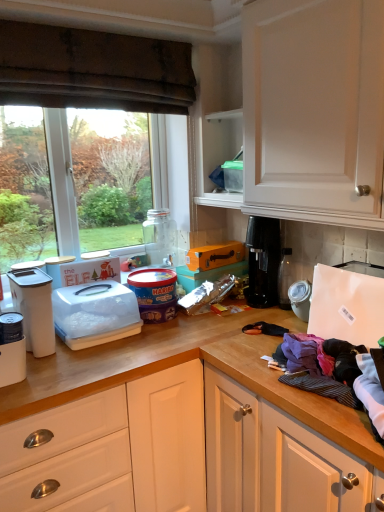
Describe the element at coordinates (95, 314) in the screenshot. The height and width of the screenshot is (512, 384). I see `white plastic container at center-left, which is the third appliance in right-to-left order` at that location.

What do you see at coordinates (215, 255) in the screenshot?
I see `orange cardboard box at center` at bounding box center [215, 255].

What do you see at coordinates (344, 359) in the screenshot?
I see `purple cotton clothes at right, the 2th clothing when ordered from back to front` at bounding box center [344, 359].

You are a GUI agent. You are given a task and a screenshot of the screen. Output one action in this format:
    pyautogui.click(x=<x>, y=<y>)
    Task: Click on the purple cotton clothes at lower right, the 3th clothing from the front
    The height and width of the screenshot is (512, 384).
    Given the screenshot: What is the action you would take?
    pyautogui.click(x=300, y=354)

Describe the element at coordinates (300, 354) in the screenshot. This screenshot has height=512, width=384. I see `purple cotton clothes at lower right, the 3th clothing from the front` at that location.

Where is `transparent glass window at upper left`? The image size is (384, 512). transparent glass window at upper left is located at coordinates (93, 69).

The height and width of the screenshot is (512, 384). Describe the element at coordinates (346, 306) in the screenshot. I see `white matte refrigerator at right, the fifth appliance viewed from the left` at that location.

Find the location of a particular element. The image size is (384, 512). brown fabric curtain at upper left is located at coordinates (93, 70).

Are orange cardboard box at center and white plastic container at center-left, which is counted as the 3th appliance, starting from the left, located far from each other?

No, orange cardboard box at center is not far away from white plastic container at center-left, which is counted as the 3th appliance, starting from the left.

From a real-world perspective, between orange cardboard box at center and white plastic container at center-left, which is counted as the 3th appliance, starting from the left, who is vertically lower?

white plastic container at center-left, which is counted as the 3th appliance, starting from the left.

Which object is further away from the camera, orange cardboard box at center or white plastic container at center-left, which is counted as the 3th appliance, starting from the left?

orange cardboard box at center is further from the camera.

Consider the image. What's the angular difference between orange cardboard box at center and white plastic container at center-left, which is the third appliance in right-to-left order,'s facing directions?

0.00163 degrees separate the facing orientations of orange cardboard box at center and white plastic container at center-left, which is the third appliance in right-to-left order.

Is white plastic container at center-left, which is counted as the 3th appliance, starting from the left, facing towards white matte refrigerator at right, the fifth appliance viewed from the left?

No, white plastic container at center-left, which is counted as the 3th appliance, starting from the left, is not facing towards white matte refrigerator at right, the fifth appliance viewed from the left.

Considering their positions, is white plastic container at center-left, which is the third appliance in right-to-left order, located in front of or behind white matte refrigerator at right, which is the 1th appliance in right-to-left order?

Visually, white plastic container at center-left, which is the third appliance in right-to-left order, is located behind white matte refrigerator at right, which is the 1th appliance in right-to-left order.

From a real-world perspective, is white plastic container at center-left, which is the third appliance in right-to-left order, physically above white matte refrigerator at right, the fifth appliance viewed from the left?

No, from a real-world perspective, white plastic container at center-left, which is the third appliance in right-to-left order, is not above white matte refrigerator at right, the fifth appliance viewed from the left.

This screenshot has height=512, width=384. There is a white matte refrigerator at right, the fifth appliance viewed from the left. Identify the location of the 1st appliance below it (from the image's perspective). (95, 314).

From the image's perspective, is white plastic container at left, the second appliance from the left, positioned above or below purple cotton clothes at lower right, the first clothing in the back-to-front sequence?

From the image's perspective, white plastic container at left, the second appliance from the left, appears above purple cotton clothes at lower right, the first clothing in the back-to-front sequence.

Is white plastic container at left, the second appliance from the left, positioned beyond the bounds of purple cotton clothes at lower right, the 3th clothing from the front?

white plastic container at left, the second appliance from the left, lies outside purple cotton clothes at lower right, the 3th clothing from the front,'s area.

Considering the sizes of white plastic container at left, the second appliance from the left, and purple cotton clothes at lower right, the first clothing in the back-to-front sequence, in the image, is white plastic container at left, the second appliance from the left, bigger or smaller than purple cotton clothes at lower right, the first clothing in the back-to-front sequence,?

Considering their sizes, white plastic container at left, the second appliance from the left, takes up more space than purple cotton clothes at lower right, the first clothing in the back-to-front sequence.

Are transparent glass jar at center and white plastic container at center-left, which is the third appliance in right-to-left order, far apart?

transparent glass jar at center is near white plastic container at center-left, which is the third appliance in right-to-left order, not far away.

From the image's perspective, between transparent glass jar at center and white plastic container at center-left, which is counted as the 3th appliance, starting from the left, which one is located above?

transparent glass jar at center, from the image's perspective.

Can you confirm if transparent glass jar at center is positioned to the left of white plastic container at center-left, which is counted as the 3th appliance, starting from the left?

Incorrect, transparent glass jar at center is not on the left side of white plastic container at center-left, which is counted as the 3th appliance, starting from the left.

Does transparent glass jar at center have a lesser width compared to white plastic container at center-left, which is the third appliance in right-to-left order?

Yes.

Is brown fabric curtain at upper left positioned in front of purple cotton clothes at right, the 2th clothing when ordered from back to front?

No, the depth of brown fabric curtain at upper left is greater than that of purple cotton clothes at right, the 2th clothing when ordered from back to front.

Which of these two, brown fabric curtain at upper left or purple cotton clothes at right, the 2th clothing when ordered from back to front, is bigger?

With larger size is brown fabric curtain at upper left.

From a real-world perspective, who is located higher, brown fabric curtain at upper left or purple cotton clothes at right, which appears as the second clothing when viewed from the front?

brown fabric curtain at upper left is physically above.

From the image's perspective, is brown fabric curtain at upper left on top of purple cotton clothes at right, which appears as the second clothing when viewed from the front?

Yes, from the image's perspective, brown fabric curtain at upper left is on top of purple cotton clothes at right, which appears as the second clothing when viewed from the front.

Based on the photo, considering the relative positions of white plastic container at left, the second appliance from the left, and purple cotton clothes at right, the 2th clothing when ordered from back to front, in the image provided, is white plastic container at left, the second appliance from the left, to the left or to the right of purple cotton clothes at right, the 2th clothing when ordered from back to front,?

Clearly, white plastic container at left, the second appliance from the left, is on the left of purple cotton clothes at right, the 2th clothing when ordered from back to front, in the image.

Could you tell me if white plastic container at left, the second appliance from the left, is turned towards purple cotton clothes at right, the 2th clothing when ordered from back to front?

No, white plastic container at left, the second appliance from the left, is not facing towards purple cotton clothes at right, the 2th clothing when ordered from back to front.

Image resolution: width=384 pixels, height=512 pixels. There is a purple cotton clothes at right, the 2th clothing when ordered from back to front. What are the coordinates of `the 4th appliance above it (from the image's perspective)` in the screenshot? It's located at click(56, 268).

Which of these two, white plastic container at left, acting as the fourth appliance starting from the right, or purple cotton clothes at right, which appears as the second clothing when viewed from the front, is thinner?

With smaller width is white plastic container at left, acting as the fourth appliance starting from the right.

Considering the relative sizes of white plastic container at left and orange cardboard box at center in the image provided, is white plastic container at left smaller than orange cardboard box at center?

Incorrect, white plastic container at left is not smaller in size than orange cardboard box at center.

Between white plastic container at left and orange cardboard box at center, which one is positioned behind?

orange cardboard box at center is further from the camera.

Is white plastic container at left aimed at orange cardboard box at center?

No, white plastic container at left is not oriented towards orange cardboard box at center.

From a real-world perspective, does white plastic container at left sit lower than orange cardboard box at center?

Yes, from a real-world perspective, white plastic container at left is beneath orange cardboard box at center.

Find the location of a particular element. This screenshot has width=384, height=512. cardboard box above the white plastic container at center-left, which is counted as the 3th appliance, starting from the left (from a real-world perspective) is located at coordinates (215, 255).

Which appliance is the 2nd one when counting from the back of the white matte refrigerator at right, which is the 1th appliance in right-to-left order? Please provide its 2D coordinates.

[(95, 314)]

Considering their positions, is white plastic container at center-left, which is the third appliance in right-to-left order, positioned further to white plastic container at left than black plastic coffee machine at right?

black plastic coffee machine at right.

Looking at the image, which one is located further to black plastic coffee machine at right, orange cardboard box at center or transparent glass window at upper left?

Among the two, transparent glass window at upper left is located further to black plastic coffee machine at right.

When comparing their distances from brown fabric curtain at upper left, does black plastic coffee machine at right or transparent glass jar at center seem closer?

transparent glass jar at center.

Estimate the real-world distances between objects in this image. Which object is closer to orange cardboard box at center, black plastic coffee machine at right or white plastic container at center-left, which is the third appliance in right-to-left order?

black plastic coffee machine at right.

From the image, which object appears to be nearer to purple cotton clothes at right, the 2th clothing when ordered from back to front, white plastic container at left or orange cardboard box at center?

orange cardboard box at center is positioned closer to the anchor purple cotton clothes at right, the 2th clothing when ordered from back to front.

Considering their positions, is white cotton shirt at lower right, which is the third clothing from back to front, positioned closer to purple cotton clothes at lower right, the first clothing in the back-to-front sequence, than brown fabric curtain at upper left?

white cotton shirt at lower right, which is the third clothing from back to front, is closer to purple cotton clothes at lower right, the first clothing in the back-to-front sequence.

Which object lies further to the anchor point white plastic container at left, acting as the fourth appliance starting from the right, white plastic container at center-left, which is the third appliance in right-to-left order, or black plastic coffee machine at right?

black plastic coffee machine at right is further to white plastic container at left, acting as the fourth appliance starting from the right.

Looking at the image, which one is located further to transparent glass jar at center, white cotton shirt at lower right, which is the third clothing from back to front, or transparent glass window at upper left?

white cotton shirt at lower right, which is the third clothing from back to front, is further to transparent glass jar at center.

Image resolution: width=384 pixels, height=512 pixels. I want to click on cardboard box between brown fabric curtain at upper left and white matte refrigerator at right, which is the 1th appliance in right-to-left order, in the up-down direction, so click(x=215, y=255).

Locate an element on the screen. appliance between brown fabric curtain at upper left and matte plastic tub at center, positioned as the 4th appliance in left-to-right order, in the up-down direction is located at coordinates (56, 268).

Image resolution: width=384 pixels, height=512 pixels. I want to click on kitchen appliance located between white plastic container at left, the second appliance from the left, and white matte refrigerator at right, the fifth appliance viewed from the left, in the left-right direction, so click(34, 308).

I want to click on bottle located between transparent glass window at upper left and purple cotton clothes at lower right, the first clothing in the back-to-front sequence, in the left-right direction, so click(x=160, y=237).